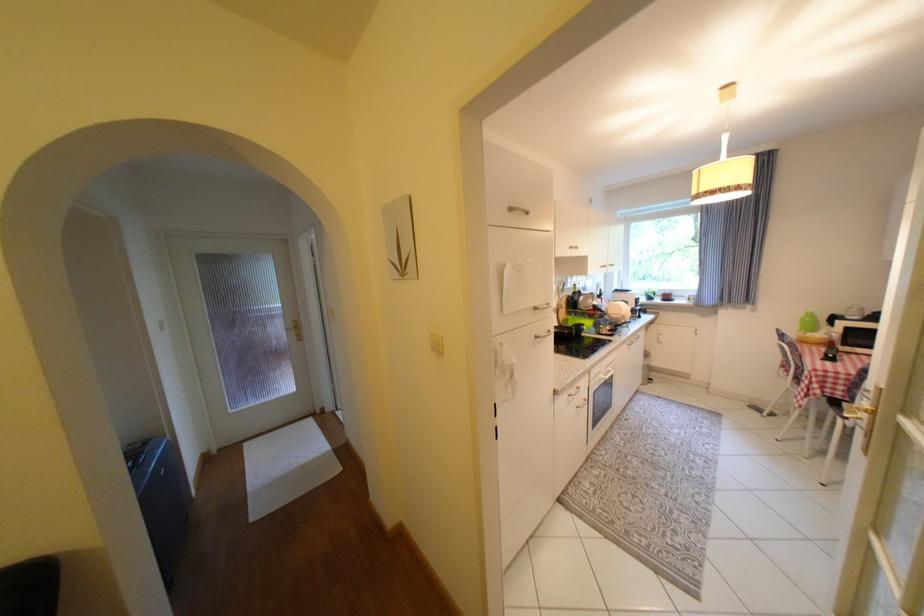
Find where to press the white light switch. Please return your answer as a coordinate pair (x, y).

(435, 342)